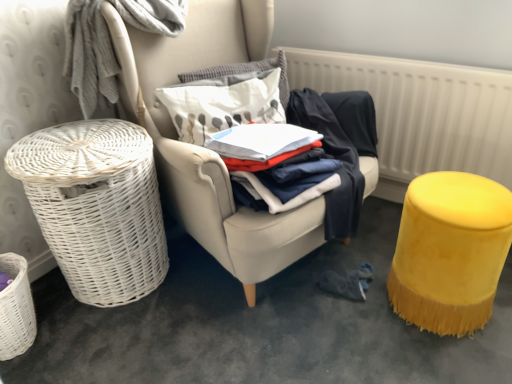
Locate an element on the screen. The image size is (512, 384). free region on the left part of yellow velvet stool at right is located at coordinates (352, 322).